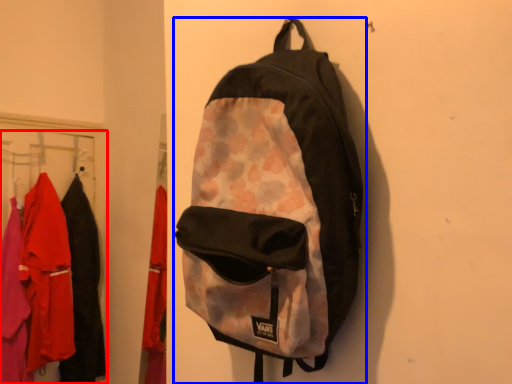
Question: Which object appears farthest to the camera in this image, closet (highlighted by a red box) or backpack (highlighted by a blue box)?

Choices:
 (A) closet
 (B) backpack

Answer: (A)